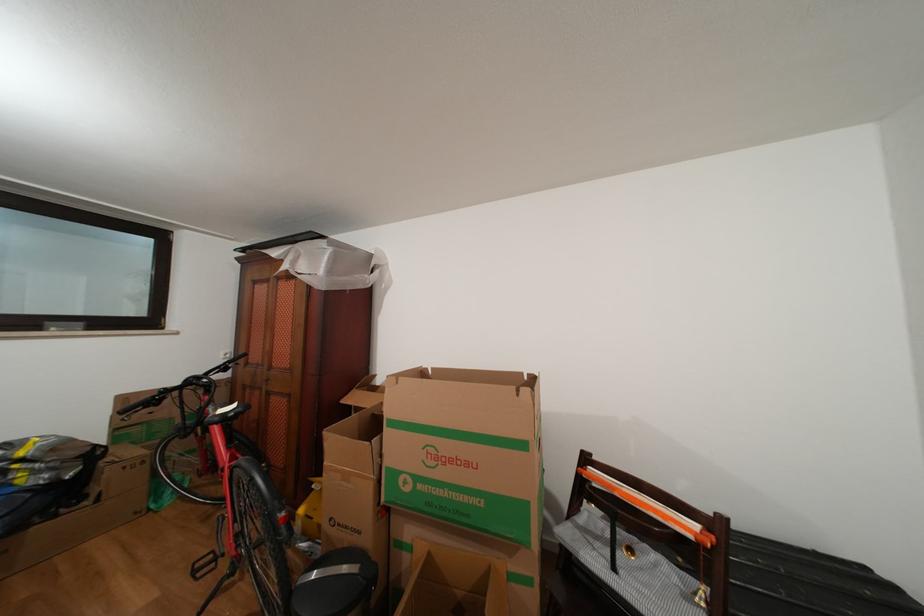
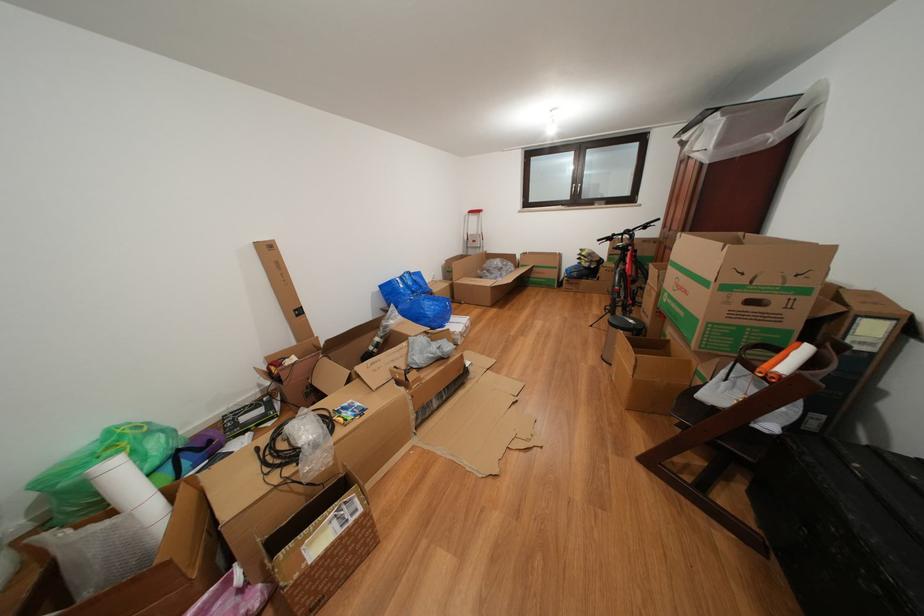
Find the pixel in the second image that matches (476,469) in the first image.

(694, 297)